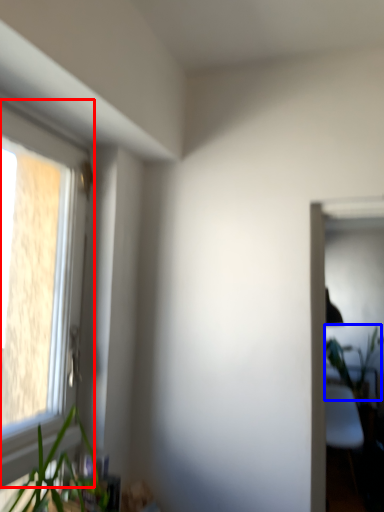
Question: Which object is further to the camera taking this photo, window (highlighted by a red box) or vegetation (highlighted by a blue box)?

Choices:
 (A) window
 (B) vegetation

Answer: (B)